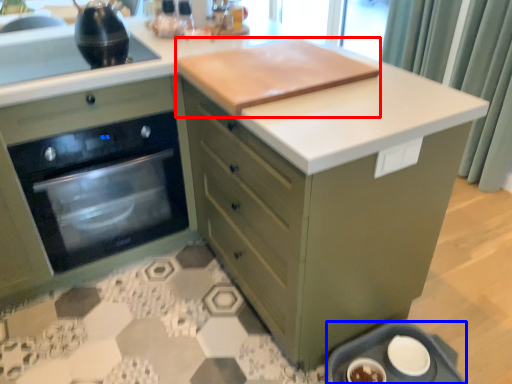
Question: Which object appears closest to the camera in this image, wide (highlighted by a red box) or appliance (highlighted by a blue box)?

Choices:
 (A) wide
 (B) appliance

Answer: (A)